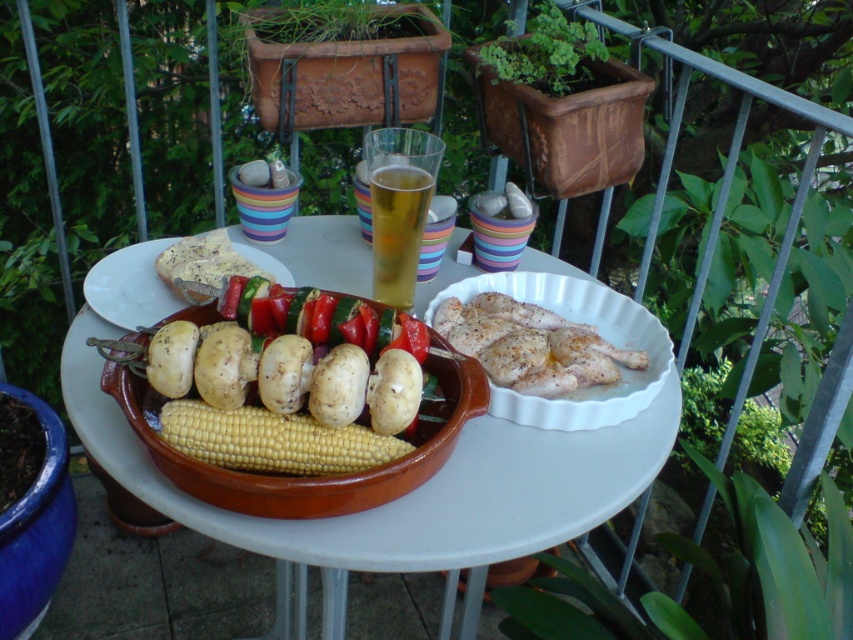
Question: Does brown ceramic bowl at center appear on the right side of smooth white potatoes at center?

Choices:
 (A) no
 (B) yes

Answer: (B)

Question: Which point appears farthest from the camera in this image?

Choices:
 (A) (393, 397)
 (B) (318, 468)

Answer: (B)

Question: Considering the real-world distances, which object is closest to the yellow matte corn at center?

Choices:
 (A) translucent glass beer at center
 (B) white paper plate at center
 (C) smooth white potatoes at center
 (D) brown ceramic bowl at center

Answer: (C)

Question: Which point is farther to the camera?

Choices:
 (A) (144, 305)
 (B) (318, 428)
 (C) (467, 438)

Answer: (A)

Question: Is smooth red pepper at center smaller than translucent glass beer at center?

Choices:
 (A) yes
 (B) no

Answer: (B)

Question: Is yellow matte corn at center further to the viewer compared to translucent glass beer at center?

Choices:
 (A) no
 (B) yes

Answer: (A)